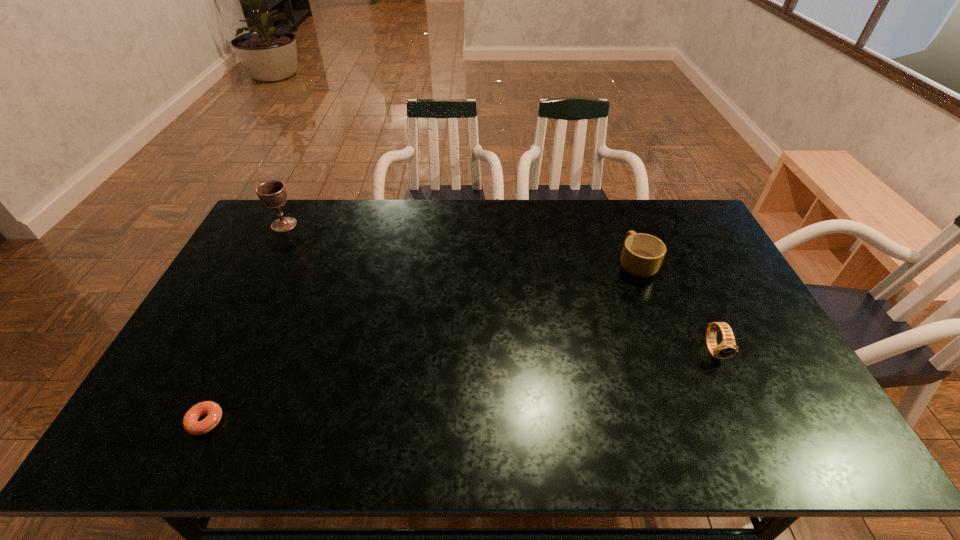
At what (x,y) coordinates should I click in order to perform the action: click on object that is positioned at the near left corner. Please return your answer as a coordinate pair (x, y). This screenshot has width=960, height=540. Looking at the image, I should click on (191, 424).

Where is `vacant region at the far edge of the desktop`? The width and height of the screenshot is (960, 540). vacant region at the far edge of the desktop is located at coordinates (337, 207).

Find the location of `vacant region at the near edge`. vacant region at the near edge is located at coordinates (228, 434).

Locate an element on the screen. This screenshot has width=960, height=540. free location at the left edge of the desktop is located at coordinates (206, 345).

The height and width of the screenshot is (540, 960). I want to click on vacant space at the right edge of the desktop, so click(x=715, y=311).

In the image, there is a desktop. Where is `vacant space at the far right corner`? vacant space at the far right corner is located at coordinates (668, 223).

Identify the location of empty location between the shortest object and the farthest object. This screenshot has height=540, width=960. (245, 323).

I want to click on vacant space in between the watch and the tallest object, so click(x=499, y=287).

The height and width of the screenshot is (540, 960). In order to click on vacant space that's between the third farthest object and the nearest object in this screenshot , I will do `click(460, 386)`.

You are a GUI agent. You are given a task and a screenshot of the screen. Output one action in this format:
    pyautogui.click(x=<x>, y=<y>)
    Task: Click on the free spot between the doughnut and the second object from right to left
    
    Given the screenshot: What is the action you would take?
    pyautogui.click(x=421, y=342)